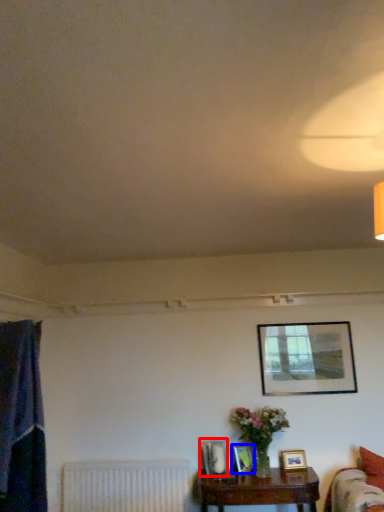
Question: Which point is closer to the camera, picture frame (highlighted by a red box) or picture frame (highlighted by a blue box)?

Choices:
 (A) picture frame
 (B) picture frame

Answer: (A)